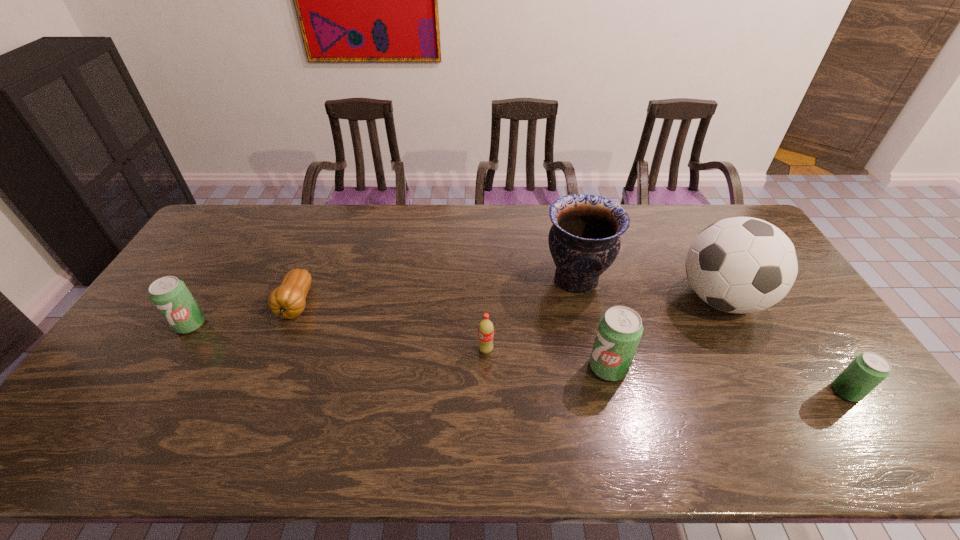
Find the location of `object positioned at the left edge`. object positioned at the left edge is located at coordinates (170, 295).

Where is `soda that is at the right edge`? soda that is at the right edge is located at coordinates (869, 369).

At what (x,y) coordinates should I click in order to perform the action: click on soccer ball that is at the right edge. Please return your answer as a coordinate pair (x, y). The image size is (960, 540). Looking at the image, I should click on (741, 265).

I want to click on object present at the near right corner, so click(869, 369).

You are a GUI agent. You are given a task and a screenshot of the screen. Output one action in this format:
    pyautogui.click(x=<x>, y=<y>)
    Task: Click on the free location at the far edge of the desktop
    The height and width of the screenshot is (540, 960).
    Given the screenshot: What is the action you would take?
    pyautogui.click(x=535, y=241)

Identify the location of vacant space at the near edge of the desktop. (311, 404).

The width and height of the screenshot is (960, 540). In order to click on free space at the left edge of the desktop in this screenshot , I will do `click(216, 251)`.

This screenshot has height=540, width=960. Identify the location of free location at the right edge of the desktop. (794, 335).

Where is `free spot at the far left corner of the desktop`? This screenshot has width=960, height=540. free spot at the far left corner of the desktop is located at coordinates point(215,239).

Find the location of a particular element. The height and width of the screenshot is (540, 960). vacant space at the near left corner of the desktop is located at coordinates (108, 413).